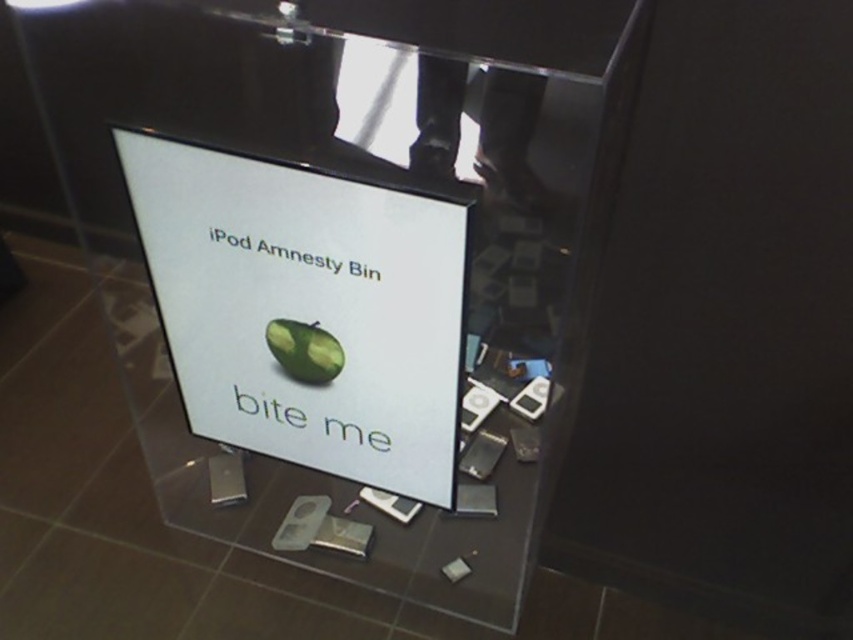
You are designing a layout for a promotional display and need to place both the white glossy sign at center and the green matte avocado at center. Based on their widths, which object should be placed on the left side to ensure they fit side by side within a 1.2 meter wide shelf?

The white glossy sign at center is wider than the green matte avocado at center. To fit them side by side on the 1.2 meter wide shelf, place the narrower green matte avocado at center on the left and the wider white glossy sign at center on the right.

You are a customer in a store and see the white glossy sign at center and the green matte avocado at center inside the acrylic box. Which object is closer to you?

The white glossy sign at center is closer to you because it is in front of the green matte avocado at center.